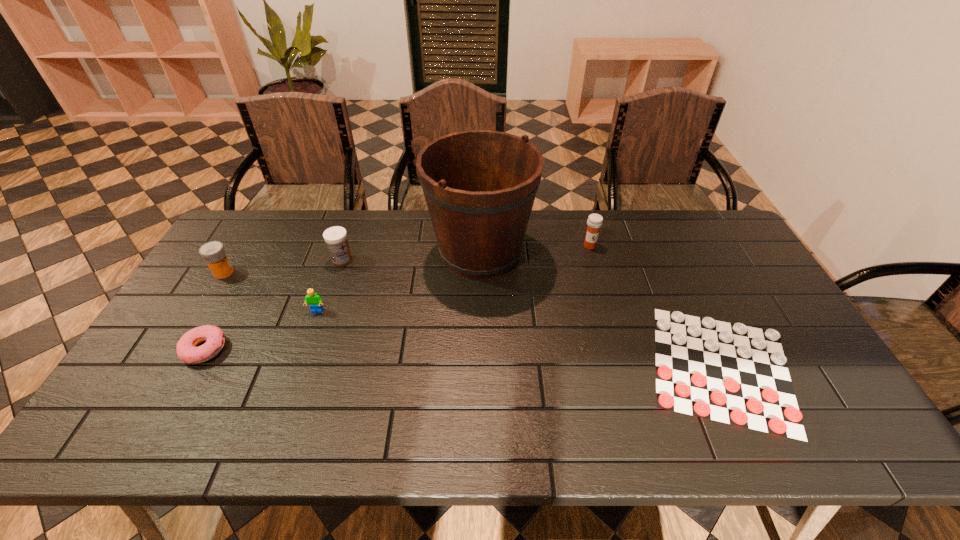
Identify the location of object that is the closest to the second medicine from left to right. (313, 299).

The width and height of the screenshot is (960, 540). I want to click on medicine that is the third closest one to the fifth tallest object, so click(x=594, y=222).

Where is `the closest medicine to the second object from right to left`? This screenshot has height=540, width=960. the closest medicine to the second object from right to left is located at coordinates (335, 237).

Locate an element on the screen. The image size is (960, 540). free space that satisfies the following two spatial constraints: 1. on the label side of the second shortest object; 2. on the left side of the leftmost medicine is located at coordinates (177, 349).

This screenshot has height=540, width=960. I want to click on vacant region that satisfies the following two spatial constraints: 1. on the label side of the rightmost object; 2. on the left side of the leftmost medicine, so click(x=166, y=367).

Image resolution: width=960 pixels, height=540 pixels. Find the location of `vacant space that satisfies the following two spatial constraints: 1. on the front side of the second medicine from right to left; 2. on the right side of the checkerboard`. vacant space that satisfies the following two spatial constraints: 1. on the front side of the second medicine from right to left; 2. on the right side of the checkerboard is located at coordinates (306, 367).

Find the location of `vacant area that satisfies the following two spatial constraints: 1. on the face of the third shortest object; 2. on the left side of the checkerboard`. vacant area that satisfies the following two spatial constraints: 1. on the face of the third shortest object; 2. on the left side of the checkerboard is located at coordinates (298, 367).